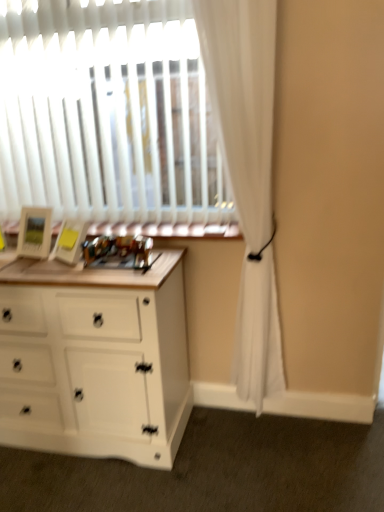
Question: Does white sheer curtain at right have a greater width compared to wooden frame at center?

Choices:
 (A) yes
 (B) no

Answer: (B)

Question: From a real-world perspective, is white sheer curtain at right positioned under wooden frame at center based on gravity?

Choices:
 (A) no
 (B) yes

Answer: (A)

Question: Is white sheer curtain at right not inside wooden frame at center?

Choices:
 (A) no
 (B) yes

Answer: (B)

Question: Are white sheer curtain at right and wooden frame at center beside each other?

Choices:
 (A) yes
 (B) no

Answer: (B)

Question: Can you confirm if white sheer curtain at right is smaller than wooden frame at center?

Choices:
 (A) yes
 (B) no

Answer: (B)

Question: Based on their sizes in the image, would you say white sheer curtain at right is bigger or smaller than wooden frame at center?

Choices:
 (A) big
 (B) small

Answer: (A)

Question: Considering their positions, is white sheer curtain at right located in front of or behind wooden frame at center?

Choices:
 (A) behind
 (B) front

Answer: (B)

Question: Do you think white sheer curtain at right is within wooden frame at center, or outside of it?

Choices:
 (A) inside
 (B) outside

Answer: (B)

Question: Considering the positions of white sheer curtain at right and wooden frame at center in the image, is white sheer curtain at right wider or thinner than wooden frame at center?

Choices:
 (A) wide
 (B) thin

Answer: (B)

Question: In terms of height, does white matte chest of drawers at left look taller or shorter compared to wooden frame at center?

Choices:
 (A) short
 (B) tall

Answer: (B)

Question: From a real-world perspective, is white matte chest of drawers at left above or below wooden frame at center?

Choices:
 (A) below
 (B) above

Answer: (A)

Question: Which is correct: white matte chest of drawers at left is inside wooden frame at center, or outside of it?

Choices:
 (A) inside
 (B) outside

Answer: (B)

Question: Based on their positions, is white matte chest of drawers at left located to the left or right of wooden frame at center?

Choices:
 (A) right
 (B) left

Answer: (B)

Question: From the image's perspective, relative to white matte chest of drawers at left, is wooden frame at center above or below?

Choices:
 (A) below
 (B) above

Answer: (B)

Question: In terms of width, does wooden frame at center look wider or thinner when compared to white matte chest of drawers at left?

Choices:
 (A) thin
 (B) wide

Answer: (A)